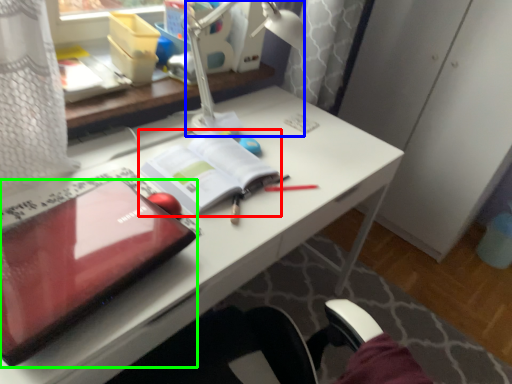
Question: Estimate the real-world distances between objects in this image. Which object is closer to paperback book (highlighted by a red box), lamp (highlighted by a blue box) or laptop (highlighted by a green box)?

Choices:
 (A) lamp
 (B) laptop

Answer: (A)